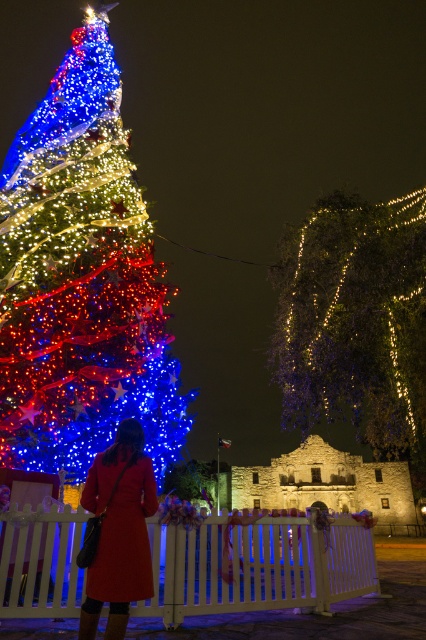
You are a photographer trying to capture the festive scene. You notice the illuminated string lights at upper right and the matte red coat at lower left. Which object would appear bigger in your photo?

The illuminated string lights at upper right would appear bigger in the photo because they have a larger size compared to the matte red coat at lower left.

You are standing in front of the Christmas tree and want to place a decoration. You have two points marked on your map as potential spots. The first is point (71, 72) and the second is point (198, 573). Which point is closer to you?

Point (71, 72) is closer to you because it is further to the viewer than point (198, 573).

You are standing at the base of the Christmas tree and want to reach the illuminated string lights at upper right without getting too close to the matte red coat at lower left. What is the minimum distance you need to walk to avoid the coat?

The minimum distance you need to walk is 191.52 feet to reach the illuminated string lights at upper right while avoiding the matte red coat at lower left.